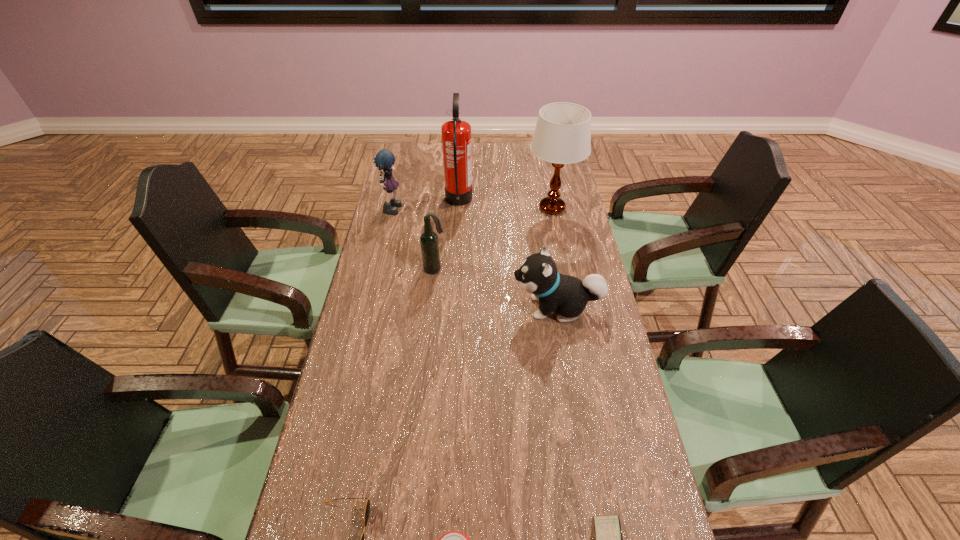
Identify the location of fire extinguisher. (456, 134).

The image size is (960, 540). In order to click on table lamp in this screenshot , I will do [562, 135].

The height and width of the screenshot is (540, 960). Find the location of `rag doll`. rag doll is located at coordinates (384, 159).

The width and height of the screenshot is (960, 540). I want to click on the fifth nearest object, so click(429, 243).

Where is `puppy`? puppy is located at coordinates (538, 275).

This screenshot has width=960, height=540. I want to click on free space located 0.340m on the front-facing side of the fire extinguisher, so click(x=553, y=201).

You are a GUI agent. You are given a task and a screenshot of the screen. Output one action in this format:
    pyautogui.click(x=<x>, y=<y>)
    Task: Click on the free space located on the front of the table lamp
    The width and height of the screenshot is (960, 540).
    Given the screenshot: What is the action you would take?
    pyautogui.click(x=563, y=263)

Where is `free spot located on the front-facing side of the rag doll`? free spot located on the front-facing side of the rag doll is located at coordinates (430, 207).

At what (x,y) coordinates should I click in order to perform the action: click on vacant region located 0.130m on the front of the beer bottle. Please return your answer as a coordinate pair (x, y). Image resolution: width=960 pixels, height=540 pixels. Looking at the image, I should click on [x=431, y=302].

Image resolution: width=960 pixels, height=540 pixels. In order to click on vacant region located at the face of the puppy in this screenshot , I will do `click(484, 307)`.